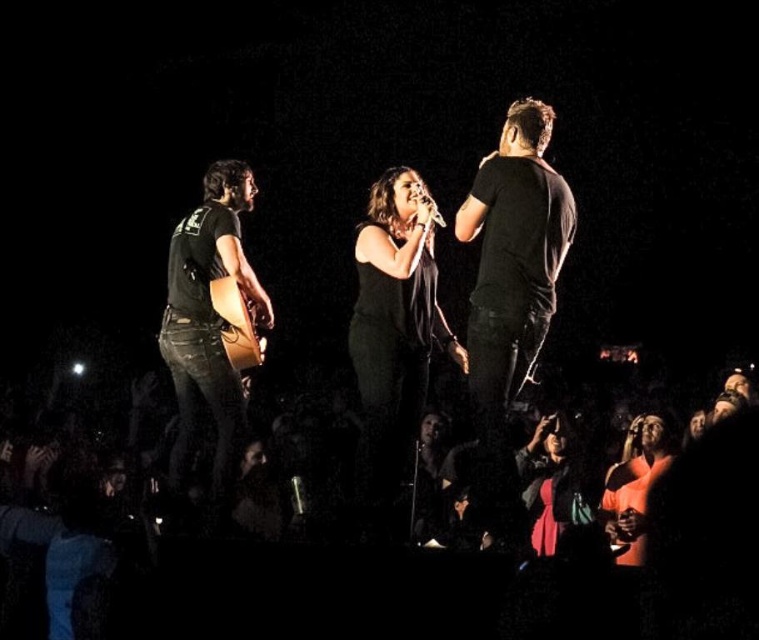
Consider the image. You are a stagehand who needs to move a 3.5 feet wide equipment cart between the dark clothing at lower center and the brown wooden guitar at center. Can you safely navigate through that space?

The distance between dark clothing at lower center and brown wooden guitar at center is 4.61 feet, which is wider than the 3.5 feet wide equipment cart. Therefore, you can safely navigate through that space.

Looking at this image, you are a photographer at the concert. You need to capture a photo where the dark clothing at lower center and the black leather guitar at left are both visible. Which object will appear smaller in the photo?

The dark clothing at lower center will appear smaller in the photo because it has a lesser height compared to the black leather guitar at left.